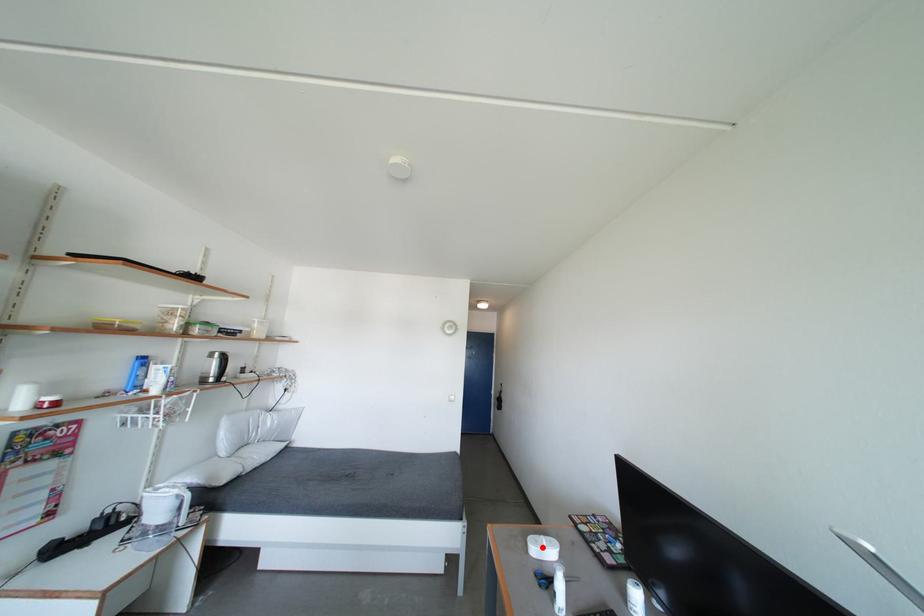
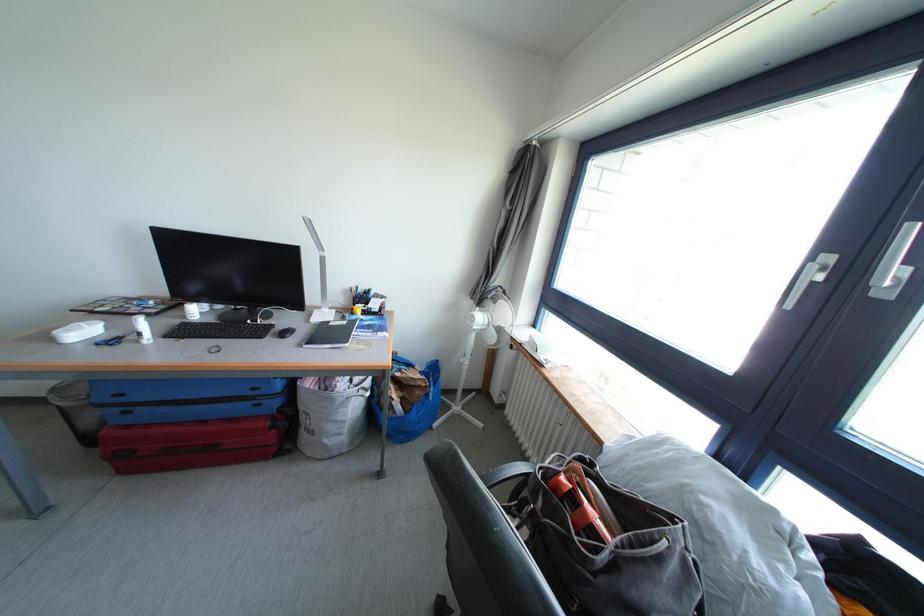
Question: I am providing you with two images of the same scene from different viewpoints. A red point is marked on the first image. Can you still see the location of the red point in image 2?

Choices:
 (A) Yes
 (B) No

Answer: (A)